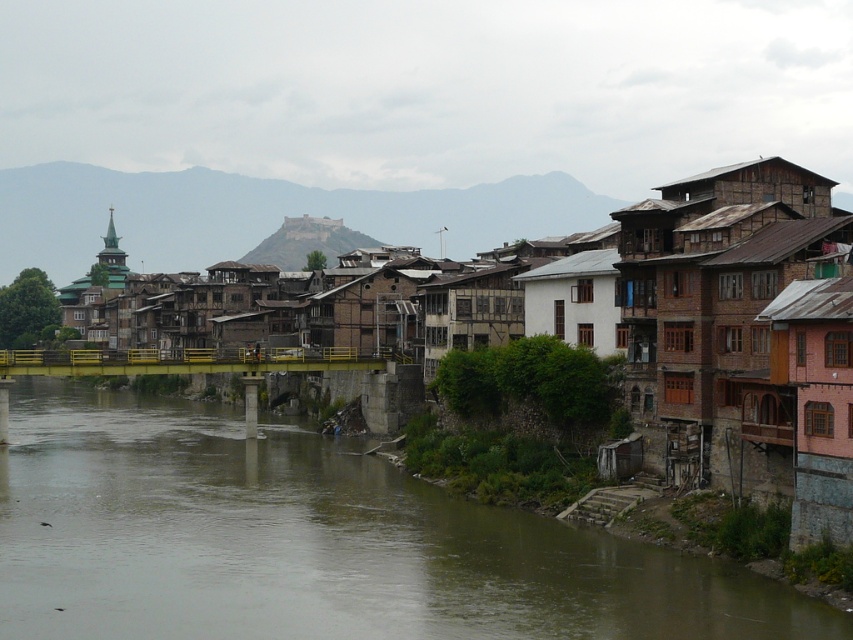
Question: Which point is farther from the camera taking this photo?

Choices:
 (A) (578, 256)
 (B) (503, 340)
 (C) (505, 608)

Answer: (B)

Question: Can you confirm if brown wooden houses at center is thinner than white wooden house at center?

Choices:
 (A) yes
 (B) no

Answer: (B)

Question: Can you confirm if white wooden house at center is positioned to the right of wooden hut at center?

Choices:
 (A) yes
 (B) no

Answer: (A)

Question: Which object is positioned farthest from the brown wooden houses at center?

Choices:
 (A) wooden hut at center
 (B) white wooden house at center

Answer: (A)

Question: Among these objects, which one is nearest to the camera?

Choices:
 (A) white wooden house at center
 (B) brown wooden houses at center
 (C) brown concrete river at lower left
 (D) wooden hut at center

Answer: (C)

Question: Does brown wooden houses at center have a lesser width compared to white wooden house at center?

Choices:
 (A) yes
 (B) no

Answer: (B)